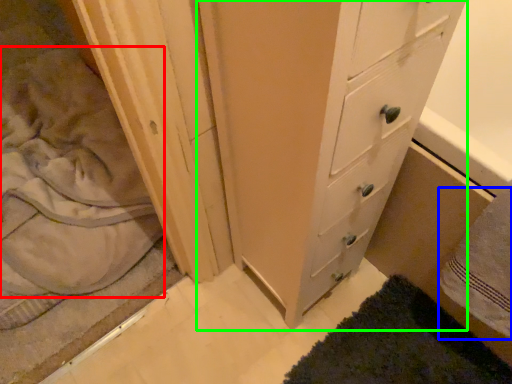
Question: Which object is positioned farthest from sheet (highlighted by a red box)? Select from bath towel (highlighted by a blue box) and chest of drawers (highlighted by a green box).

Choices:
 (A) bath towel
 (B) chest of drawers

Answer: (A)